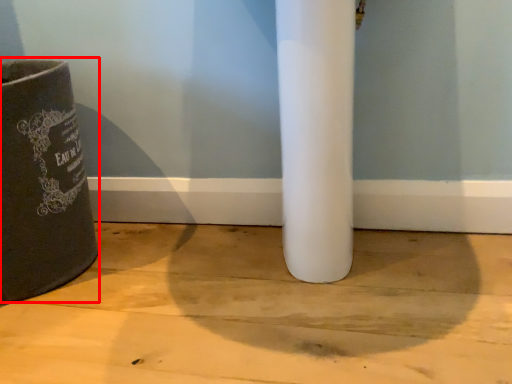
Question: Considering the relative positions of waste container (annotated by the red box) and concrete in the image provided, where is waste container (annotated by the red box) located with respect to the staircase?

Choices:
 (A) left
 (B) right

Answer: (A)